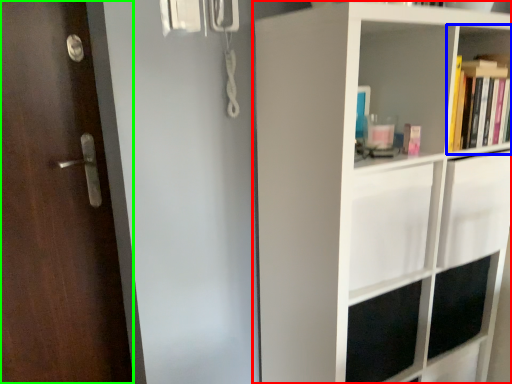
Question: Which is nearer to the shelf (highlighted by a red box)? shelf (highlighted by a blue box) or door (highlighted by a green box).

Choices:
 (A) shelf
 (B) door

Answer: (A)